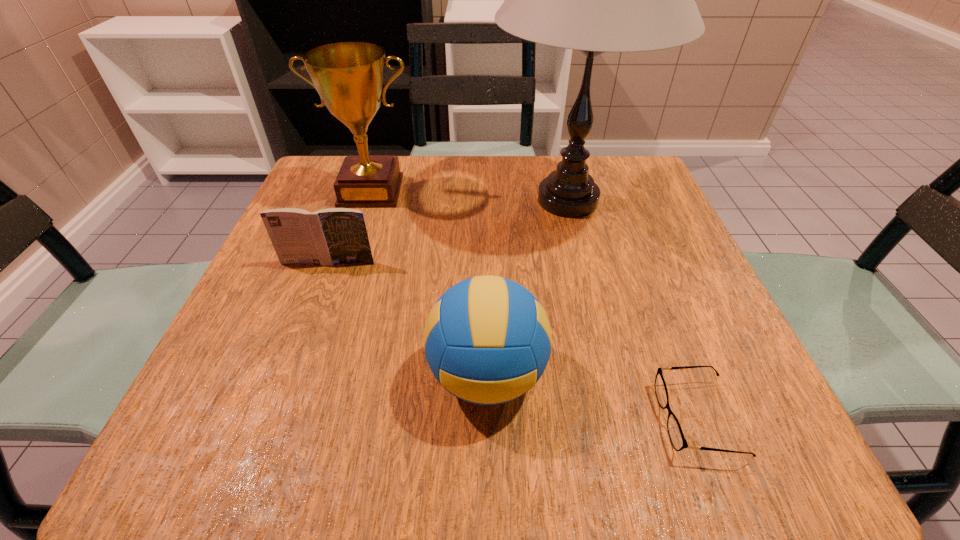
Where is `vacant area between the lamp and the second tallest object`? vacant area between the lamp and the second tallest object is located at coordinates (469, 195).

The width and height of the screenshot is (960, 540). What are the coordinates of `free spot between the third nearest object and the third shortest object` in the screenshot? It's located at (408, 319).

At what (x,y) coordinates should I click in order to perform the action: click on vacant area that lies between the volleyball and the award. Please return your answer as a coordinate pair (x, y). This screenshot has height=540, width=960. Looking at the image, I should click on (429, 283).

Identify the location of vacant area that lies between the third tallest object and the book. The height and width of the screenshot is (540, 960). pyautogui.click(x=408, y=319).

Find the location of a particular element. This screenshot has width=960, height=540. free space between the volleyball and the spectacles is located at coordinates (592, 397).

Image resolution: width=960 pixels, height=540 pixels. In order to click on free space between the spectacles and the third shortest object in this screenshot , I will do `click(592, 397)`.

Where is `empty space between the volleyball and the award`? empty space between the volleyball and the award is located at coordinates (429, 283).

I want to click on vacant space in between the tallest object and the volleyball, so click(x=527, y=288).

Image resolution: width=960 pixels, height=540 pixels. What are the coordinates of `vacant space in between the third shortest object and the second tallest object` in the screenshot? It's located at (429, 283).

Locate an element on the screen. This screenshot has height=540, width=960. object that is the closest to the spectacles is located at coordinates (487, 340).